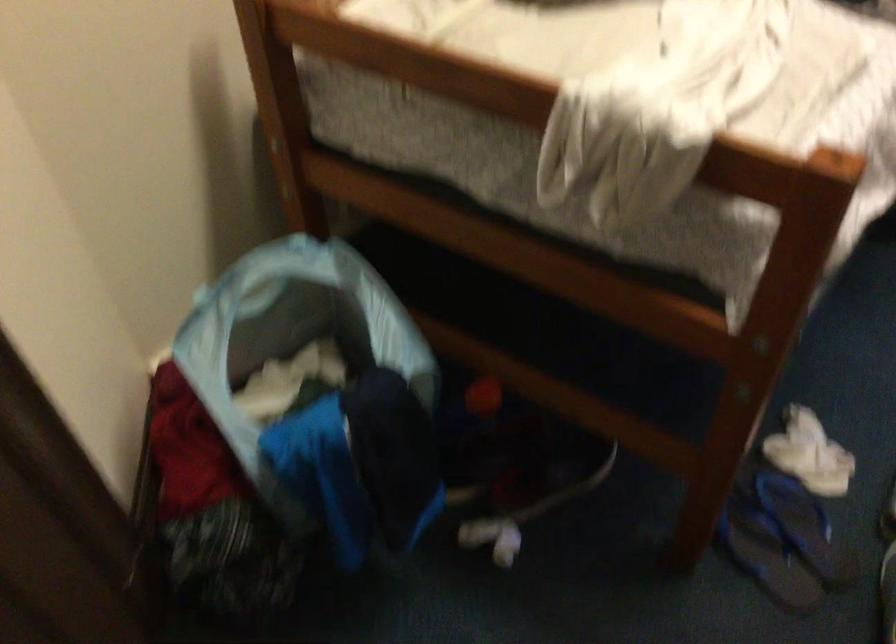
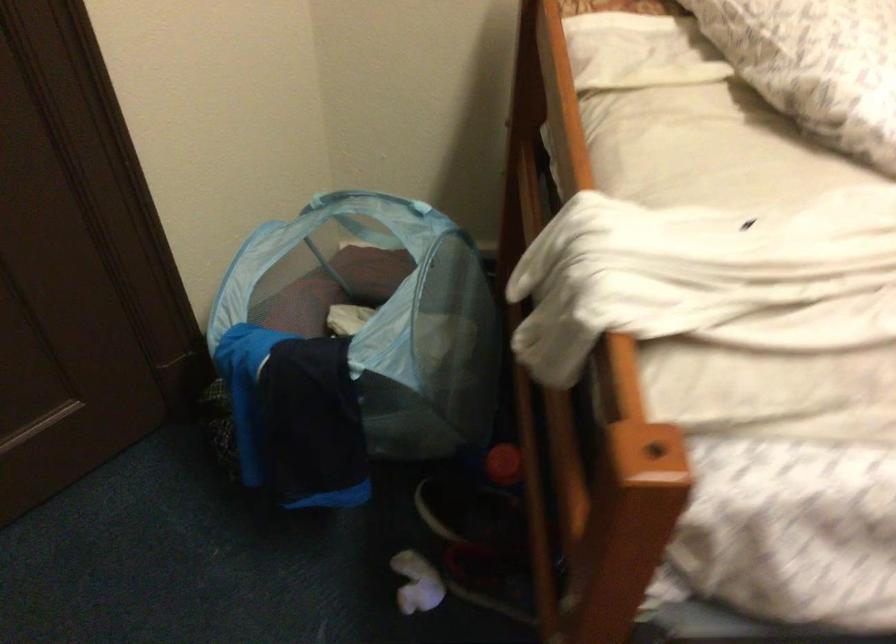
Locate, in the second image, the point that corresponds to [497,536] in the first image.

(417, 583)